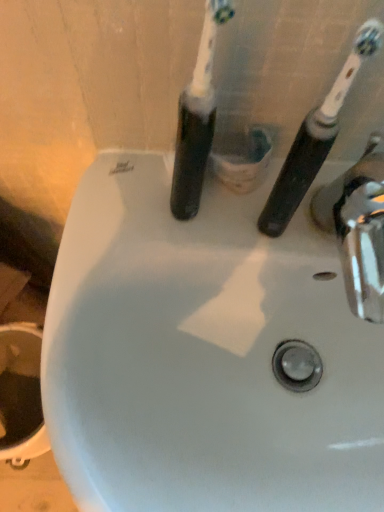
The image size is (384, 512). I want to click on vacant space to the left of black rubber toothbrush at upper right, which is the 2th toothbrush in left-to-right order, so click(142, 226).